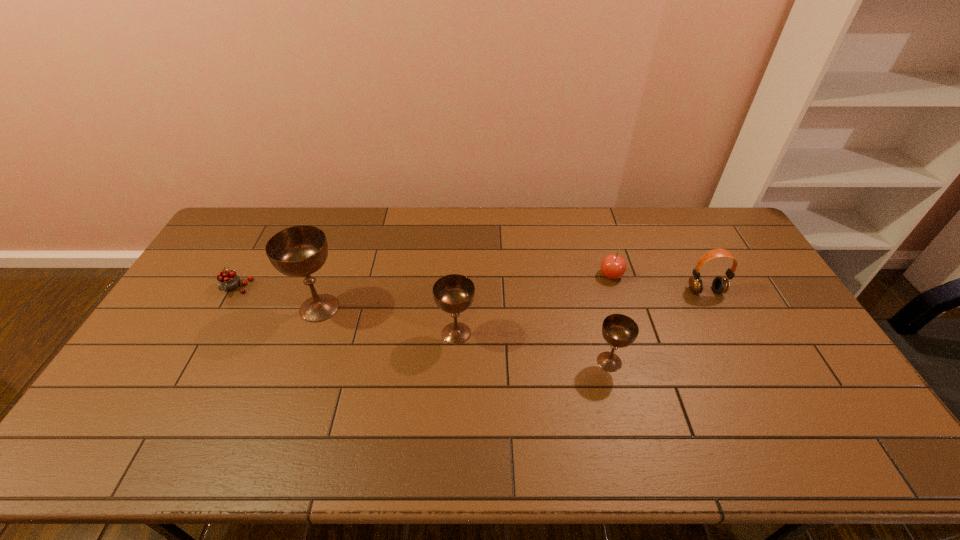
Where is `the tallest object`? This screenshot has width=960, height=540. the tallest object is located at coordinates (298, 251).

At what (x,y) coordinates should I click in order to perform the action: click on the fifth object from right to left. Please return your answer as a coordinate pair (x, y). Looking at the image, I should click on 298,251.

At what (x,y) coordinates should I click in order to perform the action: click on the second tallest object. Please return your answer as a coordinate pair (x, y). The width and height of the screenshot is (960, 540). Looking at the image, I should click on 454,293.

The image size is (960, 540). Identify the location of the second chalice from left to right. (454, 293).

Image resolution: width=960 pixels, height=540 pixels. Find the location of `the shortest chalice`. the shortest chalice is located at coordinates (618, 330).

Locate an element on the screen. This screenshot has height=540, width=960. apple is located at coordinates (613, 266).

Locate an element on the screen. The width and height of the screenshot is (960, 540). headset is located at coordinates point(720,284).

Locate an element on the screen. the leftmost object is located at coordinates (228, 280).

You are a GUI agent. You are given a task and a screenshot of the screen. Output one action in this format:
    pyautogui.click(x=<x>, y=<y>)
    Task: Click on the free location located 0.220m on the front of the tallest object
    
    Given the screenshot: What is the action you would take?
    pyautogui.click(x=290, y=393)

You are a GUI agent. You are given a task and a screenshot of the screen. Output one action in this format:
    pyautogui.click(x=<x>, y=<y>)
    Task: Click on the free space located on the back of the fifth shortest object
    The width and height of the screenshot is (960, 540).
    Given the screenshot: What is the action you would take?
    pyautogui.click(x=458, y=300)